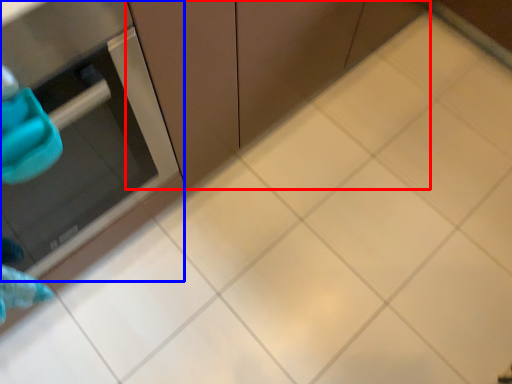
Question: Which of the following is the farthest to the observer, cabinetry (highlighted by a red box) or appliance (highlighted by a blue box)?

Choices:
 (A) cabinetry
 (B) appliance

Answer: (A)